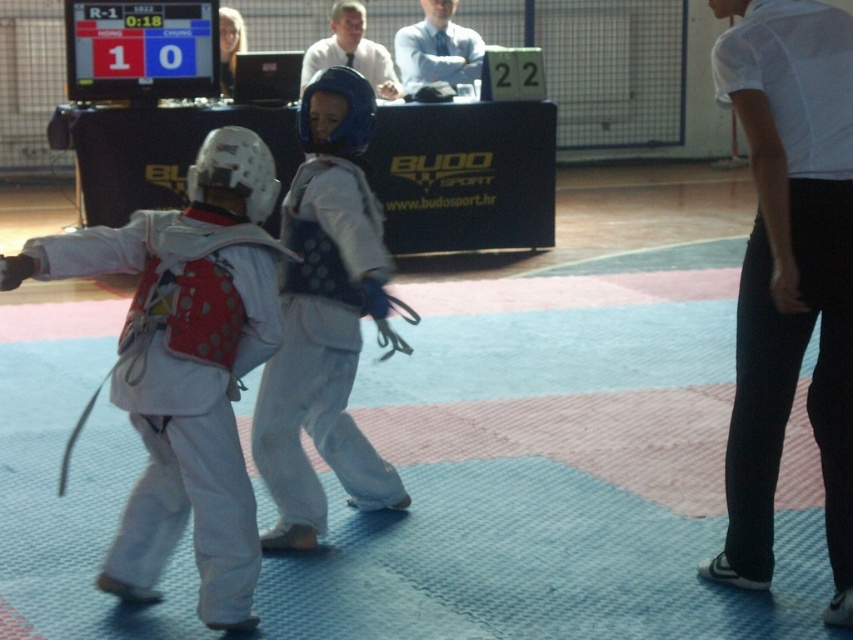
You are a spectator sitting in the front row of the martial arts competition. You notice two objects in the image labeled as the white shirt at upper center and the blonde hair at upper center. Which one do you see closer to your position?

The white shirt at upper center is closer to the viewer than the blonde hair at upper center, so you see the white shirt at upper center closer to your position.

You are a judge observing a martial arts competition. You notice two participants wearing the white matte karate uniform at left and the white smooth shirt at upper right. Which participant is positioned to the left of the other?

The white matte karate uniform at left is positioned to the left of the white smooth shirt at upper right.